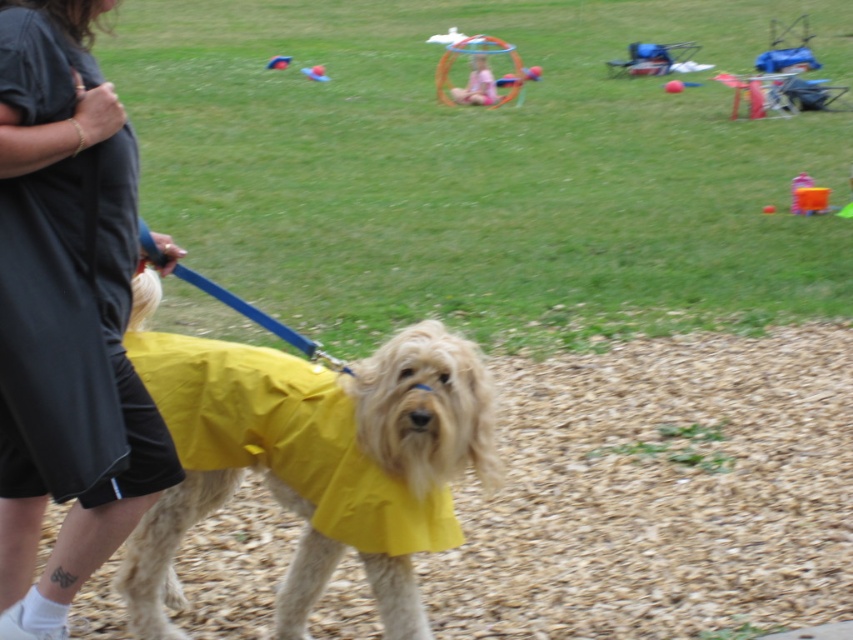
You are a photographer trying to capture a photo of the yellow fabric dog at center without including the black fabric dress at left in the frame. Based on their positions, is this possible?

The black fabric dress at left is to the left of the yellow fabric dog at center, so if you position yourself to the right side of the yellow fabric dog at center and frame the shot to exclude the left side, you can capture the yellow fabric dog at center without including the black fabric dress at left.

You are standing at the point labeled point (138,408) and want to walk to the point labeled point (367,493). Which direction should you move to get closer to your destination?

To move from point (138,408) to point (367,493), you should move towards the upper right direction since point (367,493) is farther from the viewer compared to your current position.